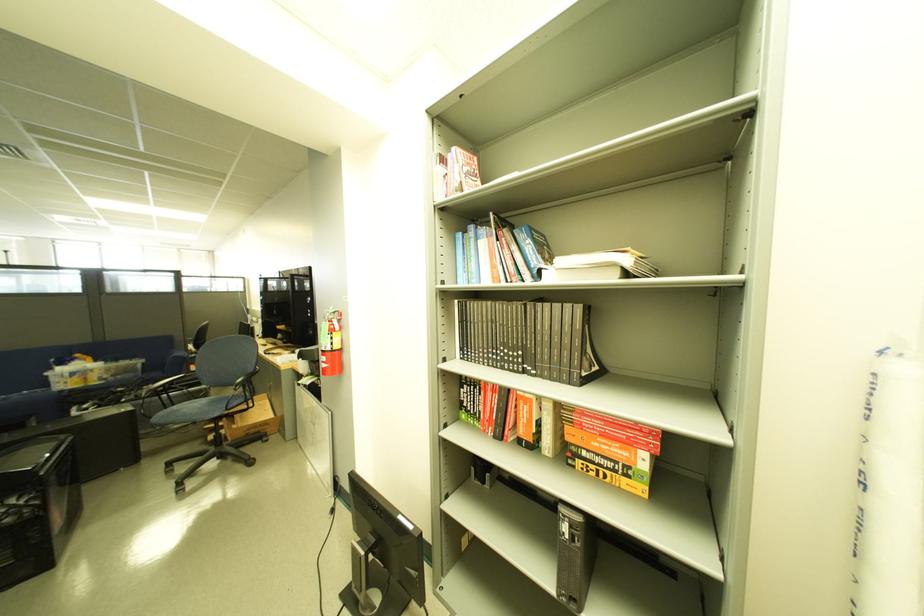
At what (x,y) coordinates should I click in order to perform the action: click on blue sofa sitting surface. Please return your answer as a coordinate pair (x, y). Image resolution: width=924 pixels, height=616 pixels. Looking at the image, I should click on (46, 394).